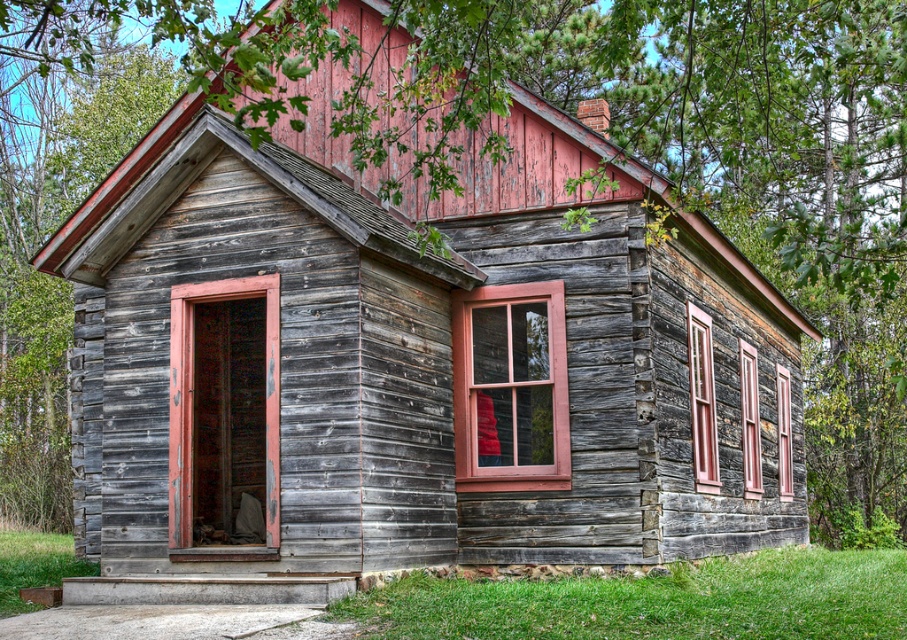
Question: Which point is closer to the camera taking this photo?

Choices:
 (A) (788, 387)
 (B) (169, 372)
 (C) (709, 449)

Answer: (B)

Question: Which point appears farthest from the camera in this image?

Choices:
 (A) (756, 387)
 (B) (785, 426)
 (C) (695, 372)
 (D) (183, 435)

Answer: (B)

Question: Observing the image, what is the correct spatial positioning of wooden door at center in reference to wooden window at center right?

Choices:
 (A) left
 (B) right

Answer: (A)

Question: Is matte wooden window at center behind wooden window at right?

Choices:
 (A) yes
 (B) no

Answer: (B)

Question: Which point appears closest to the camera in this image?

Choices:
 (A) (701, 317)
 (B) (275, 452)
 (C) (787, 484)
 (D) (473, 400)

Answer: (B)

Question: Is wooden window at center right wider than wooden window at right?

Choices:
 (A) no
 (B) yes

Answer: (A)